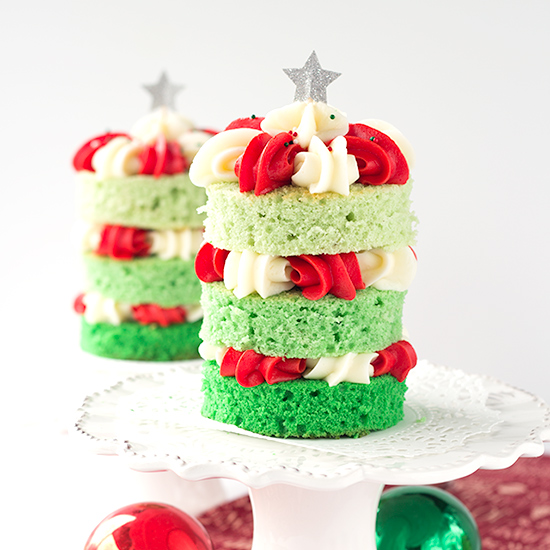
Locate an element on the screen. The height and width of the screenshot is (550, 550). green bulb is located at coordinates (414, 515).